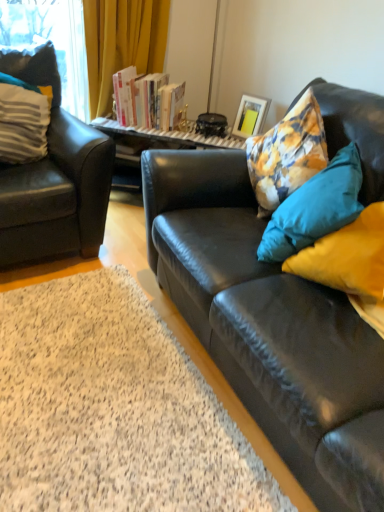
Question: Is hardcover books at center taller or shorter than floral fabric cushion at right, which ranks as the first pillow in right-to-left order?

Choices:
 (A) tall
 (B) short

Answer: (B)

Question: Based on their sizes in the image, would you say hardcover books at center is bigger or smaller than floral fabric cushion at right, which ranks as the first pillow in right-to-left order?

Choices:
 (A) small
 (B) big

Answer: (A)

Question: Based on their relative distances, which object is nearer to the hardcover books at center?

Choices:
 (A) floral fabric cushion at right, acting as the 2th pillow starting from the left
 (B) black leather couch at right
 (C) white striped pillow at left, acting as the first pillow starting from the left
 (D) black leather couch at right
 (E) matte black armchair at left

Answer: (C)

Question: Estimate the real-world distances between objects in this image. Which object is closer to the matte black armchair at left?

Choices:
 (A) white striped pillow at left, which is counted as the 2th pillow, starting from the right
 (B) black leather couch at right
 (C) black leather couch at right
 (D) matte white picture frame at upper center
 (E) floral fabric cushion at right, acting as the 2th pillow starting from the left

Answer: (A)